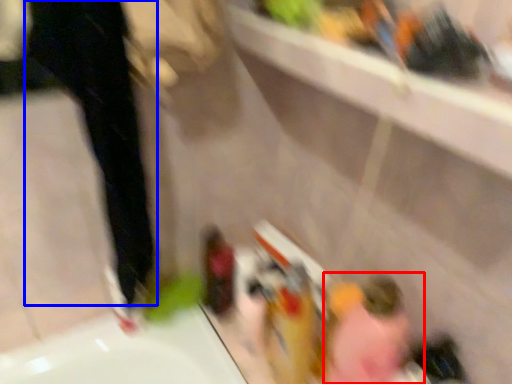
Question: Which object is further to the camera taking this photo, woman (highlighted by a red box) or pants (highlighted by a blue box)?

Choices:
 (A) woman
 (B) pants

Answer: (A)